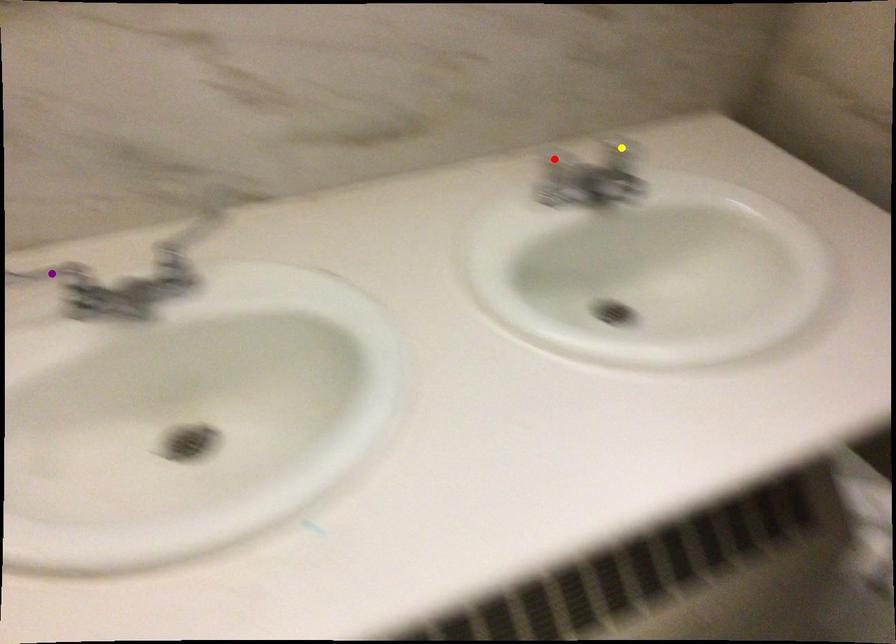
Order these from nearest to farthest:
1. yellow point
2. purple point
3. red point

yellow point, red point, purple point